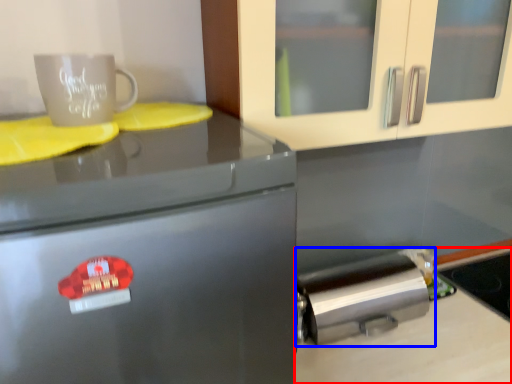
Question: Among these objects, which one is farthest to the camera, counter top (highlighted by a red box) or kitchen appliance (highlighted by a blue box)?

Choices:
 (A) counter top
 (B) kitchen appliance

Answer: (B)